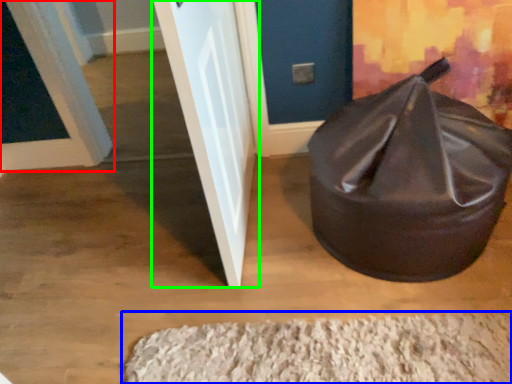
Question: Based on their relative distances, which object is farther from door (highlighted by a red box)? Choose from doormat (highlighted by a blue box) and door (highlighted by a green box).

Choices:
 (A) doormat
 (B) door

Answer: (A)